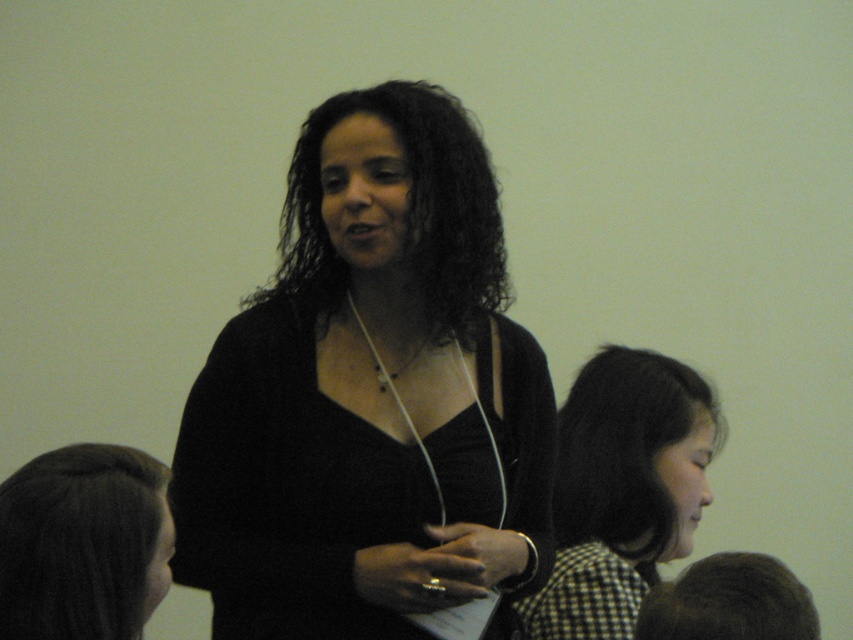
Is dark brown hair at lower left taller than dark brown hair at lower right?

Correct, dark brown hair at lower left is much taller as dark brown hair at lower right.

Is the position of dark brown hair at lower left more distant than that of dark brown hair at lower right?

No, it is in front of dark brown hair at lower right.

Where is `dark brown hair at lower left`? dark brown hair at lower left is located at coordinates (79, 541).

I want to click on black matte/black fabric at center, so click(x=370, y=396).

Does black matte/black fabric at center appear on the right side of dark brown hair at lower right?

In fact, black matte/black fabric at center is to the left of dark brown hair at lower right.

Where is `black matte/black fabric at center`? The height and width of the screenshot is (640, 853). black matte/black fabric at center is located at coordinates (370, 396).

At what (x,y) coordinates should I click in order to perform the action: click on black matte/black fabric at center. Please return your answer as a coordinate pair (x, y). The width and height of the screenshot is (853, 640). Looking at the image, I should click on (370, 396).

Which of these two, dark curly hair at center or dark brown hair at lower right, stands taller?

Standing taller between the two is dark curly hair at center.

Between point (306, 312) and point (718, 634), which one is positioned behind?

Positioned behind is point (306, 312).

At what (x,y) coordinates should I click in order to perform the action: click on dark curly hair at center. Please return your answer as a coordinate pair (x, y). Looking at the image, I should click on (409, 211).